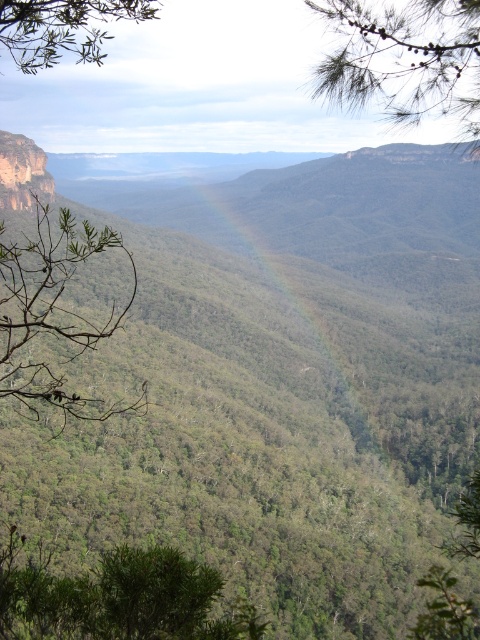
Based on the photo, which is above, rainbow at center or green leafy branch at upper left?

green leafy branch at upper left is above.

Does rainbow at center appear over green leafy branch at upper left?

Incorrect, rainbow at center is not positioned above green leafy branch at upper left.

Who is more forward, (186, 216) or (47, 20)?

Point (47, 20)

Locate an element on the screen. The image size is (480, 640). rainbow at center is located at coordinates (x=268, y=264).

Does green leafy tree at lower center have a lesser height compared to green leafy branch at left?

Indeed, green leafy tree at lower center has a lesser height compared to green leafy branch at left.

Is point (70, 609) positioned before point (44, 269)?

Yes, point (70, 609) is closer to viewer.

Image resolution: width=480 pixels, height=640 pixels. I want to click on green leafy tree at lower center, so click(x=119, y=598).

I want to click on green matte pine branch at upper right, so click(405, 60).